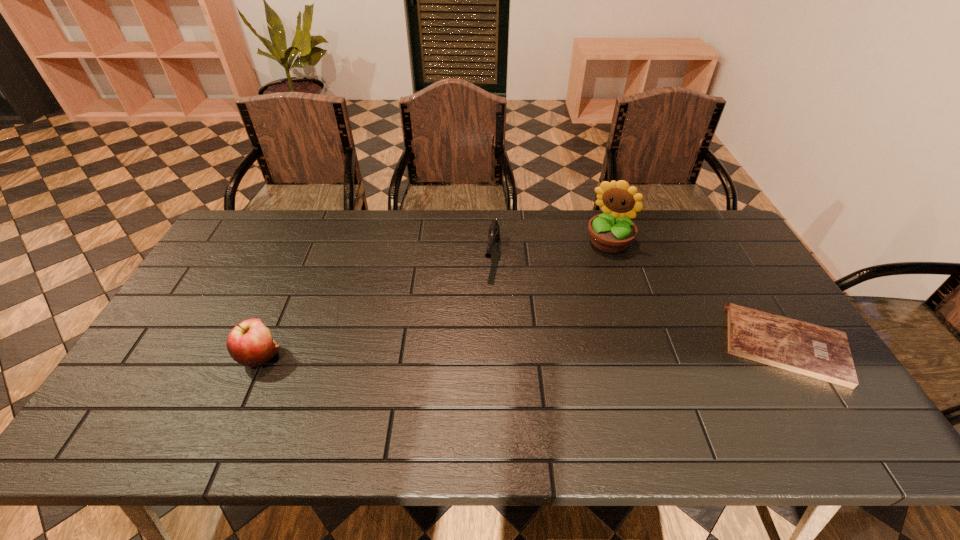
Identify the location of vacant area that satisfies the following two spatial constraints: 1. on the front side of the rightmost object; 2. on the right side of the third object from right to left. The image size is (960, 540). (495, 346).